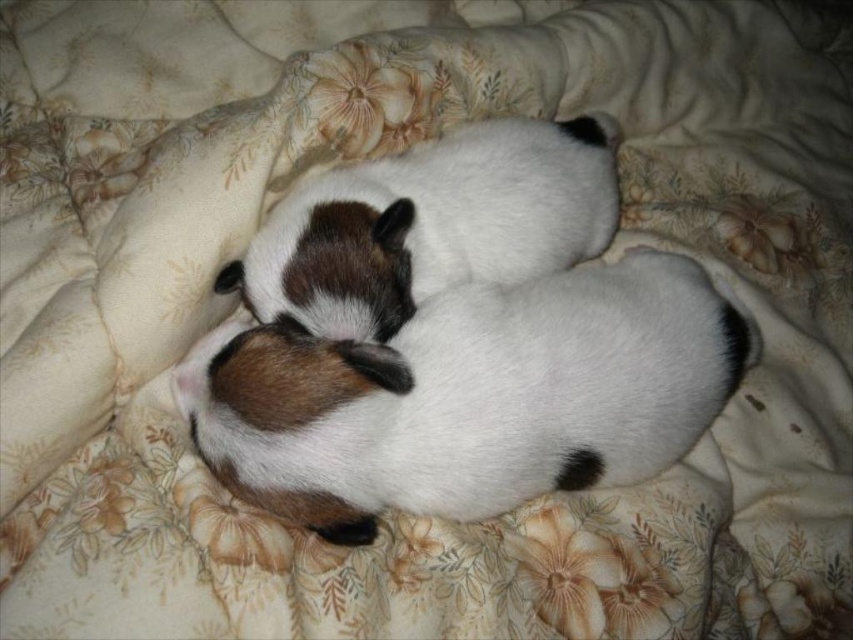
Which is above, white fur dog at center or white soft fur dog at center?

white soft fur dog at center is higher up.

The width and height of the screenshot is (853, 640). Describe the element at coordinates (469, 396) in the screenshot. I see `white fur dog at center` at that location.

The height and width of the screenshot is (640, 853). Identify the location of white fur dog at center. (469, 396).